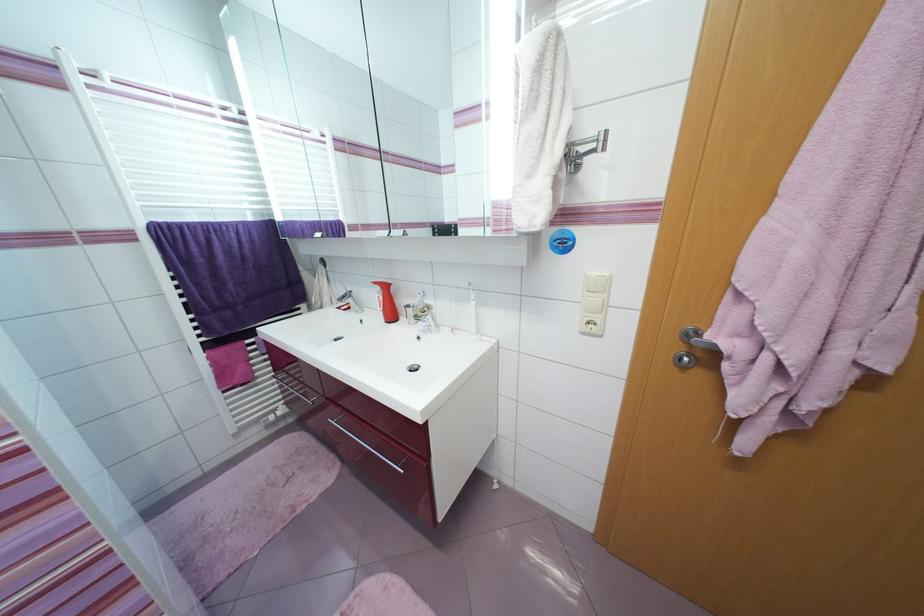
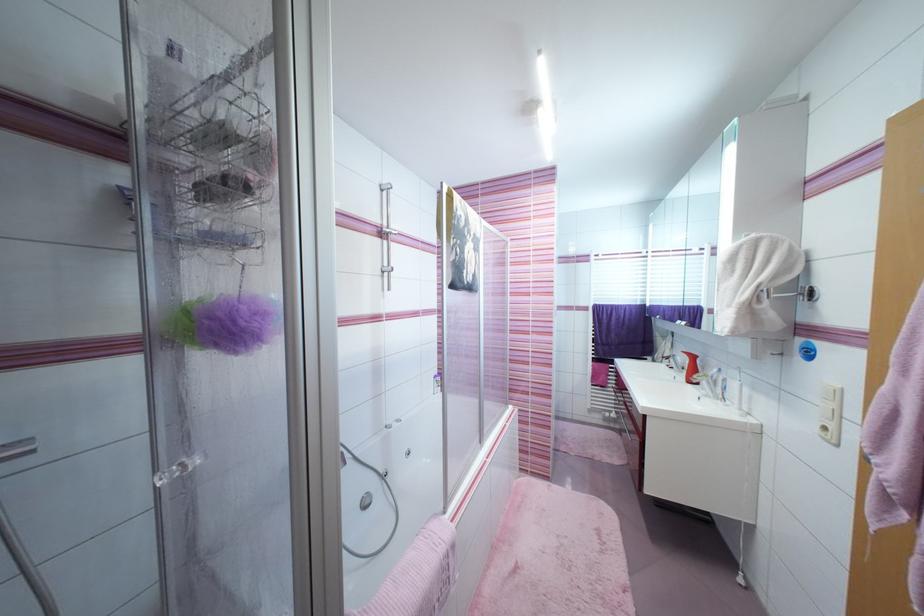
The point at (430, 333) is marked in the first image. Where is the corresponding point in the second image?

(711, 398)